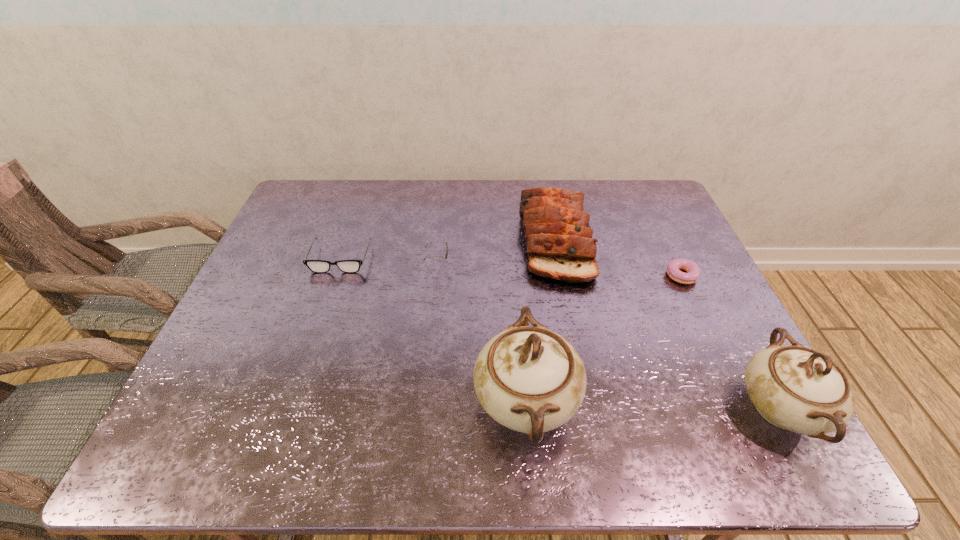
Locate an element on the screen. object present at the near right corner is located at coordinates (795, 388).

Locate an element on the screen. vacant space at the far edge of the desktop is located at coordinates coord(368,218).

Where is `vacant area at the near edge`? vacant area at the near edge is located at coordinates (447, 401).

Where is `free location at the left edge of the desktop`? This screenshot has width=960, height=540. free location at the left edge of the desktop is located at coordinates (283, 331).

You are a GUI agent. You are given a task and a screenshot of the screen. Output one action in this format:
    pyautogui.click(x=<x>, y=<y>)
    Task: Click on the blank space at the right edge of the desktop
    
    Given the screenshot: What is the action you would take?
    pyautogui.click(x=652, y=233)

I want to click on blank space at the far left corner of the desktop, so click(296, 211).

You are a GUI agent. You are given a task and a screenshot of the screen. Output one action in this format:
    pyautogui.click(x=<x>, y=<y>)
    Task: Click on the blank space at the near left corner of the desktop
    The width and height of the screenshot is (960, 540).
    Given the screenshot: What is the action you would take?
    pyautogui.click(x=240, y=392)

Identify the location of free spot between the bread and the sunglasses. The image size is (960, 540). (495, 252).

Find the location of a particular element. The width and height of the screenshot is (960, 540). vacant region between the bread and the fourth tallest object is located at coordinates (495, 252).

You are a GUI agent. You are given a task and a screenshot of the screen. Output one action in this format:
    pyautogui.click(x=<x>, y=<y>)
    Task: Click on the unoccupied position between the bread and the sunglasses
    The height and width of the screenshot is (540, 960).
    Given the screenshot: What is the action you would take?
    pyautogui.click(x=495, y=252)